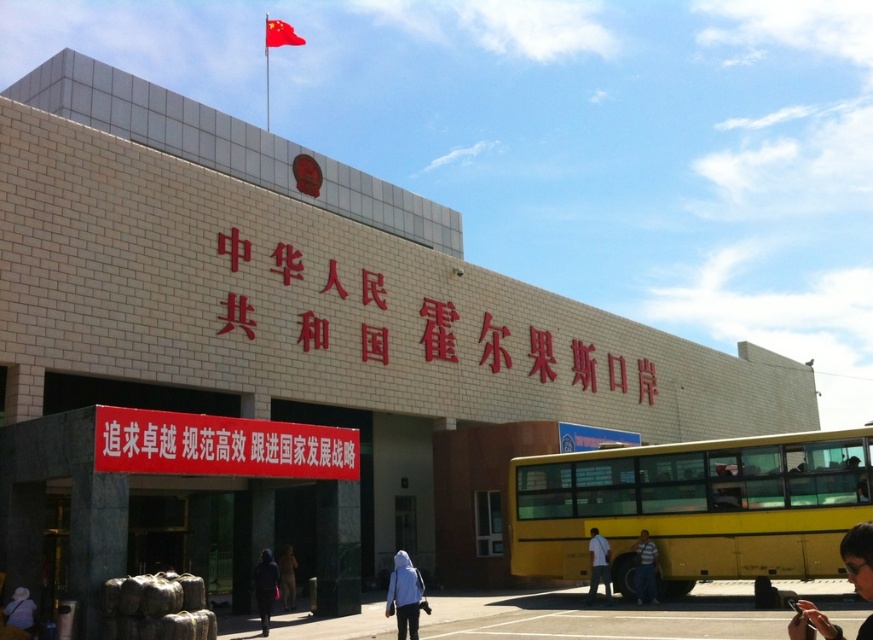
Does red brick sign at center have a greater height compared to dark brown leather jacket at lower center?

Yes, red brick sign at center is taller than dark brown leather jacket at lower center.

How much distance is there between red brick sign at center and dark brown leather jacket at lower center?

19.60 meters

Does point (442, 324) lie behind point (289, 554)?

Yes.

What are the coordinates of `red brick sign at center` in the screenshot? It's located at (438, 330).

Is point (441, 353) farther from viewer compared to point (19, 621)?

That is True.

Does point (436, 339) come in front of point (19, 632)?

No, (436, 339) is behind (19, 632).

Between point (428, 308) and point (25, 598), which one is positioned in front?

Point (25, 598) is more forward.

At what (x,y) coordinates should I click in order to perform the action: click on red brick sign at center. Please return your answer as a coordinate pair (x, y). This screenshot has height=640, width=873. Looking at the image, I should click on (438, 330).

In the scene shown: Which is more to the left, yellow matte bus at lower right or dark hair at lower right?

Positioned to the left is yellow matte bus at lower right.

Is yellow matte bus at lower right behind dark hair at lower right?

Yes.

Between point (630, 586) and point (798, 612), which one is positioned behind?

The point (630, 586) is more distant.

At what (x,y) coordinates should I click in order to perform the action: click on yellow matte bus at lower right. Please return your answer as a coordinate pair (x, y). This screenshot has width=873, height=640. Looking at the image, I should click on click(x=693, y=508).